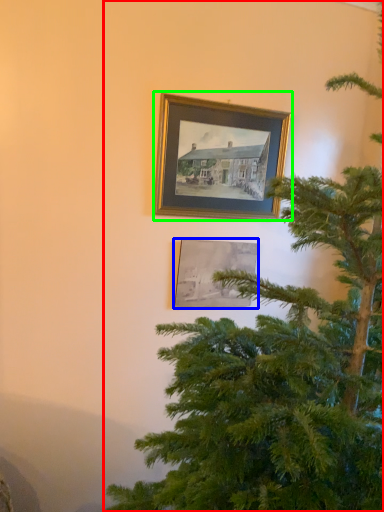
Question: Considering the real-world distances, which object is farthest from christmas tree (highlighted by a red box)? picture frame (highlighted by a blue box) or picture frame (highlighted by a green box)?

Choices:
 (A) picture frame
 (B) picture frame

Answer: (B)